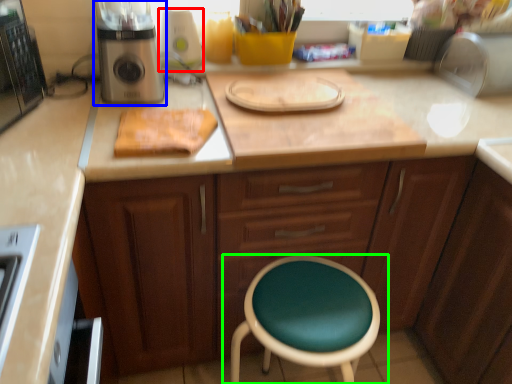
Question: Considering the real-world distances, which object is closest to appliance (highlighted by a red box)? kitchen appliance (highlighted by a blue box) or chair (highlighted by a green box).

Choices:
 (A) kitchen appliance
 (B) chair

Answer: (A)